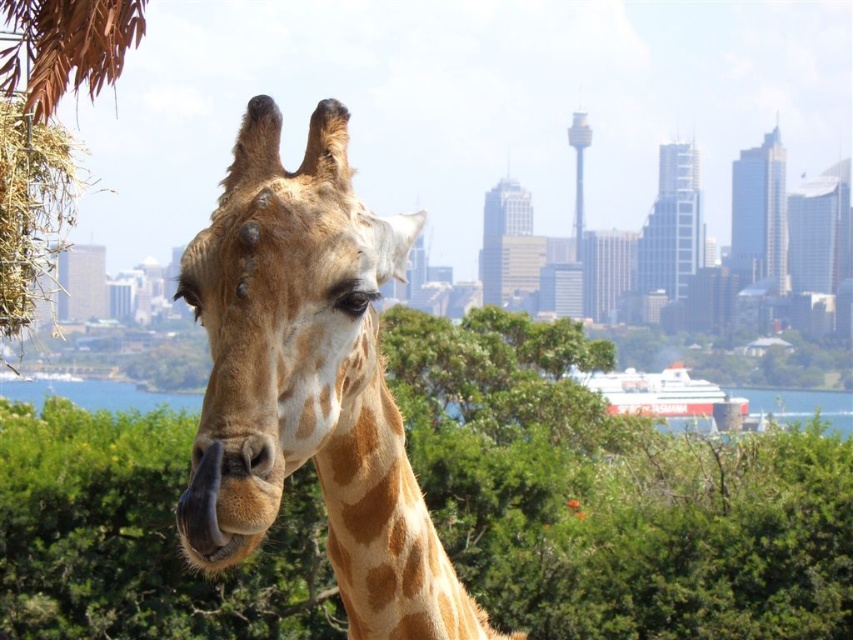
Question: Which object is positioned closest to the spotted fur giraffe at center?

Choices:
 (A) green leafy tree at center
 (B) clear blue water at center

Answer: (A)

Question: Is spotted fur giraffe at center thinner than clear blue water at center?

Choices:
 (A) yes
 (B) no

Answer: (A)

Question: Where is green leafy tree at center located in relation to clear blue water at center in the image?

Choices:
 (A) right
 (B) left

Answer: (B)

Question: Which point is farther to the camera?

Choices:
 (A) (158, 394)
 (B) (270, 184)
 (C) (561, 465)

Answer: (A)

Question: Which of the following is the farthest from the observer?

Choices:
 (A) (115, 602)
 (B) (221, 262)
 (C) (161, 392)

Answer: (C)

Question: Is green leafy tree at center wider than spotted fur giraffe at center?

Choices:
 (A) yes
 (B) no

Answer: (A)